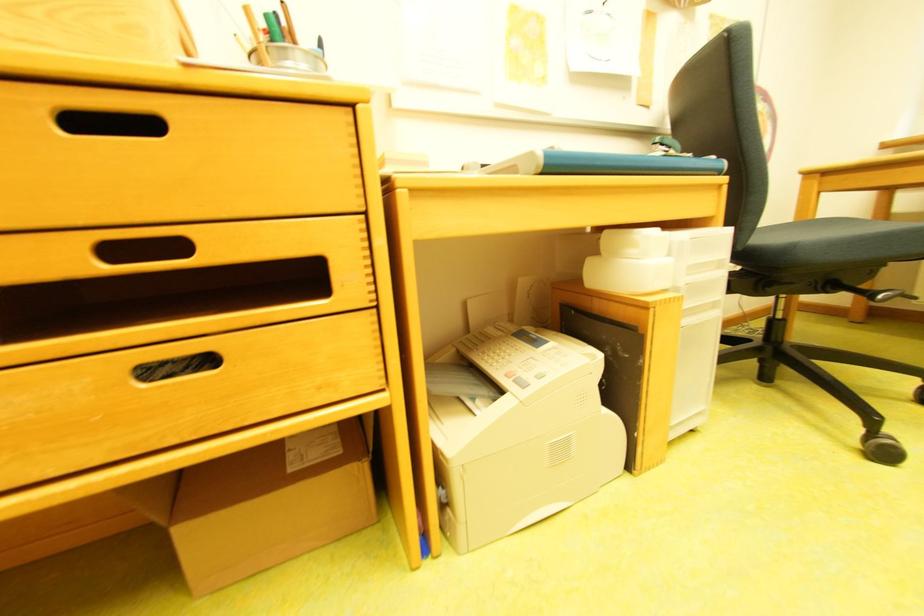
Which object does [262,504] point to?

This point indicates the cardboard box.